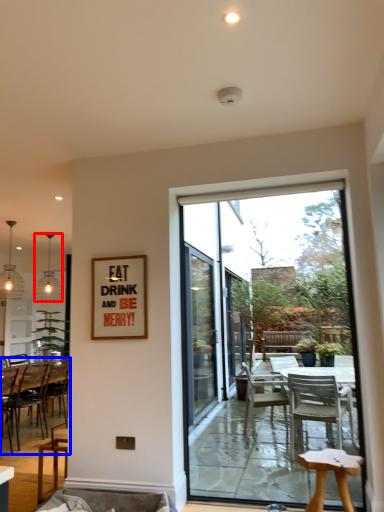
Question: Which of the following is the farthest to the observer, lamp (highlighted by a red box) or chair (highlighted by a blue box)?

Choices:
 (A) lamp
 (B) chair

Answer: (A)